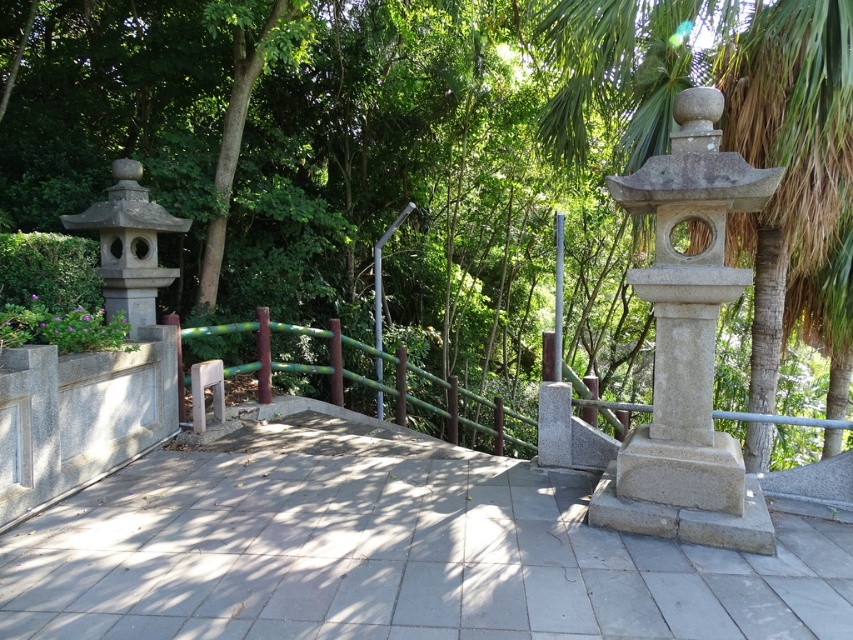
You are standing at the starting point of the pathway and want to reach the end. Which of the two points, point 1 at coordinates point (335, 490) or point 2 at coordinates point (635, 92), is closer to you as you begin your walk?

Point 1 at coordinates point (335, 490) is closer to you because it is closer to the camera than point 2 at coordinates point (635, 92).

You are a gardener planning to plant a new tree in this outdoor area. Considering the green leafy tree at upper center and the gray concrete path at center, which object occupies more space in the scene?

The green leafy tree at upper center occupies more space in the scene compared to the gray concrete path at center because it has a larger size.

You are standing at the point marked as point (426, 154) in the image. Looking around, you see a green leafy tree at upper center. Which direction should you face to look directly at the green leafy tree at upper center?

You should face upward because the green leafy tree at upper center is located at point (426, 154), which is the upper center position in the image.